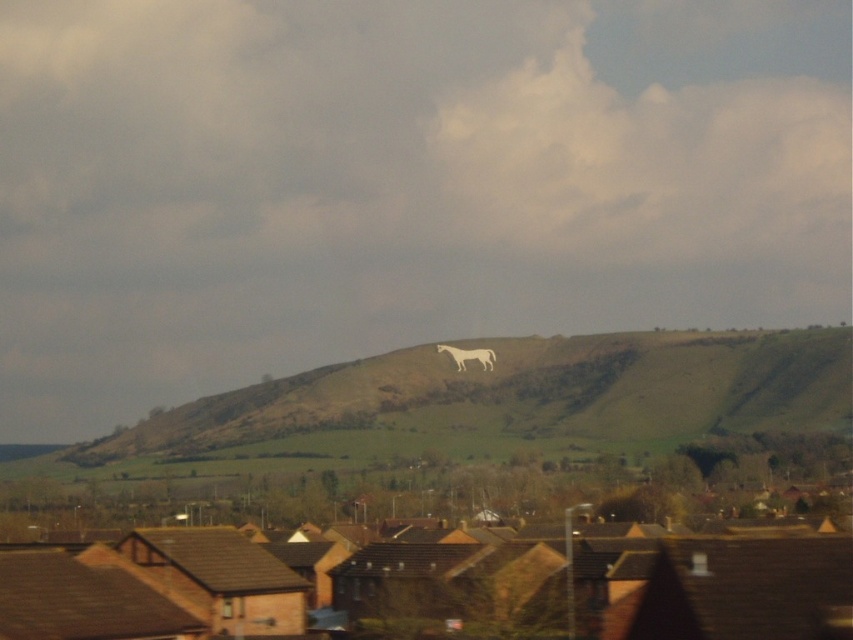
Does cloudy sky at upper center have a smaller size compared to white stone horse at center?

No.

Who is shorter, cloudy sky at upper center or white stone horse at center?

white stone horse at center is shorter.

Where is `cloudy sky at upper center`? This screenshot has width=853, height=640. cloudy sky at upper center is located at coordinates (398, 182).

This screenshot has width=853, height=640. What are the coordinates of `cloudy sky at upper center` in the screenshot? It's located at (398, 182).